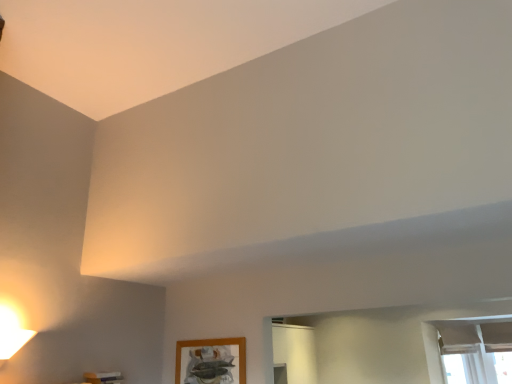
Question: Looking at their shapes, would you say wooden picture frame at lower center is wider or thinner than white sheer curtain at lower right?

Choices:
 (A) thin
 (B) wide

Answer: (A)

Question: Is wooden picture frame at lower center inside or outside of white sheer curtain at lower right?

Choices:
 (A) outside
 (B) inside

Answer: (A)

Question: Based on their relative distances, which object is nearer to the matte white remote at lower left?

Choices:
 (A) white sheer curtain at lower right
 (B) wooden picture frame at lower center

Answer: (B)

Question: Which object is the farthest from the wooden picture frame at lower center?

Choices:
 (A) matte white remote at lower left
 (B) white sheer curtain at lower right

Answer: (B)